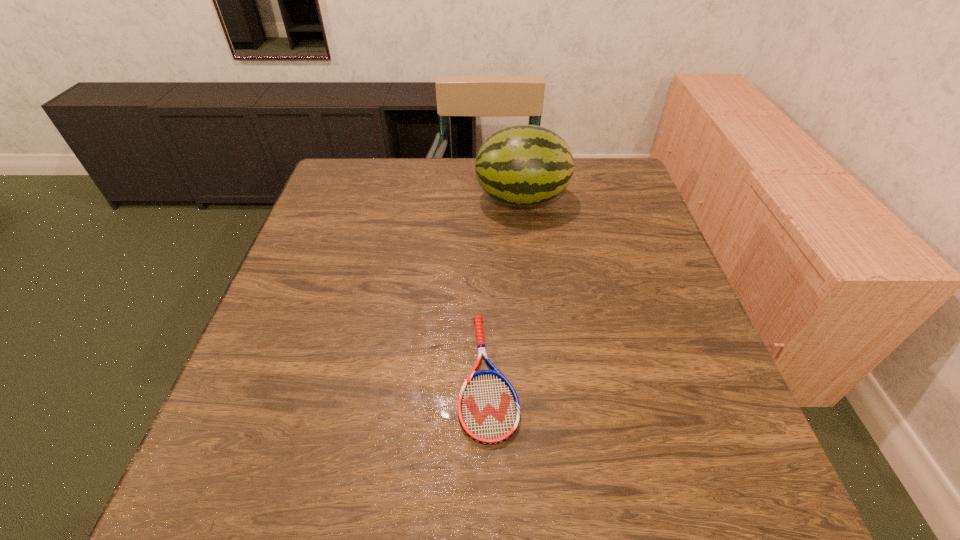
Where is `the farther object`? The height and width of the screenshot is (540, 960). the farther object is located at coordinates pyautogui.click(x=520, y=165).

At what (x,y) coordinates should I click in order to perform the action: click on watermelon. Please return your answer as a coordinate pair (x, y). The image size is (960, 540). Looking at the image, I should click on (520, 165).

Identify the location of the shorter object. (488, 407).

The height and width of the screenshot is (540, 960). Identify the location of tennis racket. (488, 407).

The image size is (960, 540). I want to click on vacant area located at the stem end of the taller object, so click(x=406, y=199).

At what (x,y) coordinates should I click in order to perform the action: click on vacant space located 0.330m at the stem end of the taller object. Please return your answer as a coordinate pair (x, y). The height and width of the screenshot is (540, 960). Looking at the image, I should click on (356, 199).

Locate an element on the screen. free space located 0.270m at the stem end of the taller object is located at coordinates (377, 199).

Identify the location of free spot located on the left of the nearer object. (416, 375).

The width and height of the screenshot is (960, 540). I want to click on object positioned at the far edge, so click(520, 165).

Find the location of `blank area at the far edge`. blank area at the far edge is located at coordinates (390, 186).